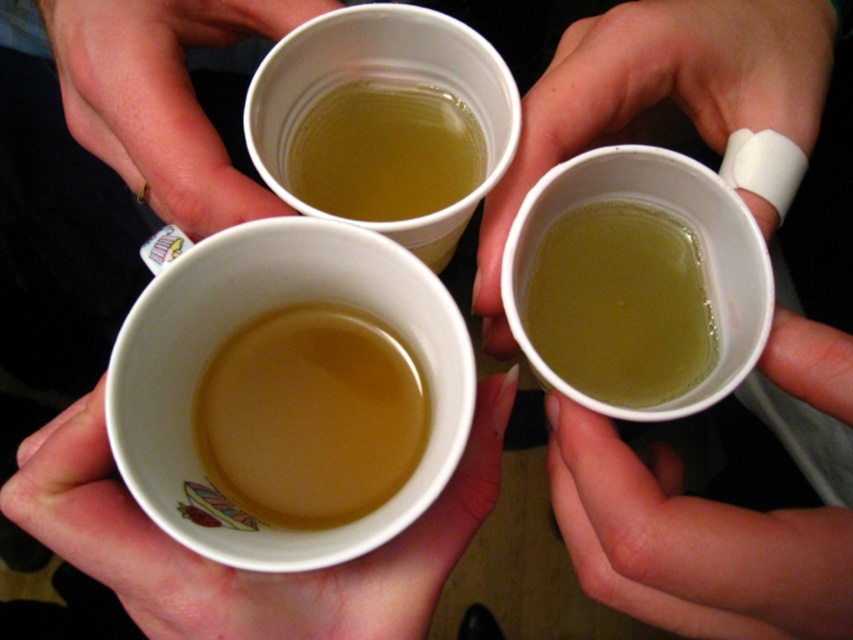
You are a nurse checking a patient in a hospital room. You see a white bandage at right and a translucent paper cup at upper center. Which object is closer to you?

The white bandage at right is closer to you because it is in front of the translucent paper cup at upper center.

You are a photographer trying to capture a closeup of the cup with the strawberry and cake handle. You notice two points marked in the image at coordinates point [700,88] and point [410,173]. Which point should you focus on to ensure the strawberry and cake handle is in sharp focus?

Point [700,88] is in front of point [410,173], so focusing on point [700,88] will ensure the strawberry and cake handle is in sharp focus.

You are a medical professional observing this scene. You notice a white bandage at right. Based on its position, can you determine if it is located in the upper or lower half of the image?

The white bandage at right is located at point coordinates of 0.150 on the x axis and 0.774 on the y axis. Since the y coordinate is above 0.5, it is in the upper half of the image.